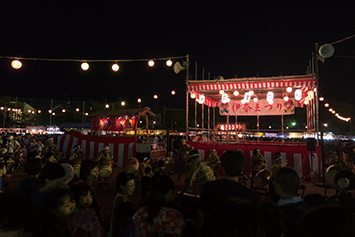
Identify the location of lantern. (146, 64).